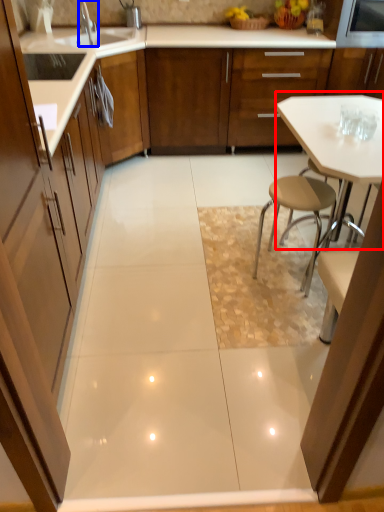
Question: Which object appears closest to the camera in this image, table (highlighted by a red box) or tap (highlighted by a blue box)?

Choices:
 (A) table
 (B) tap

Answer: (A)